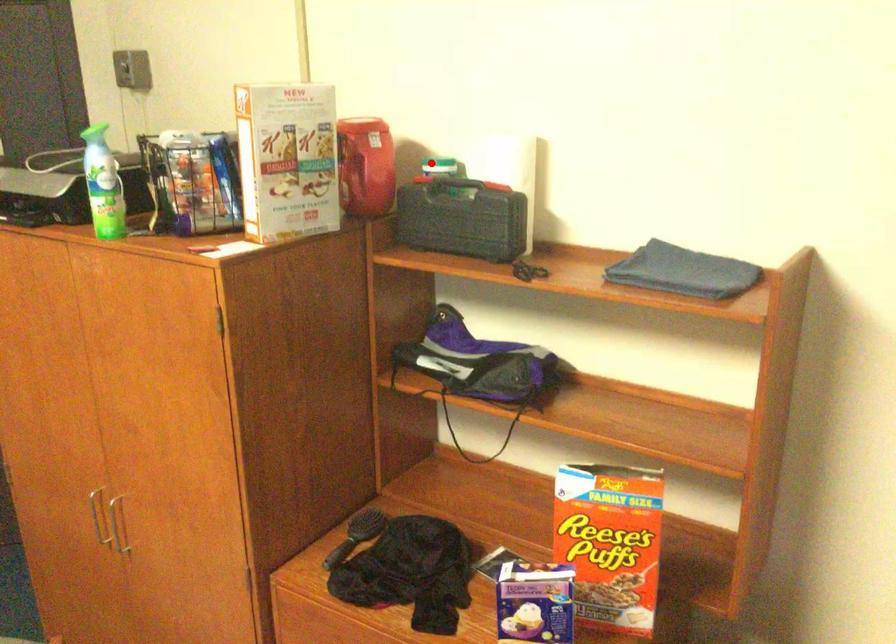
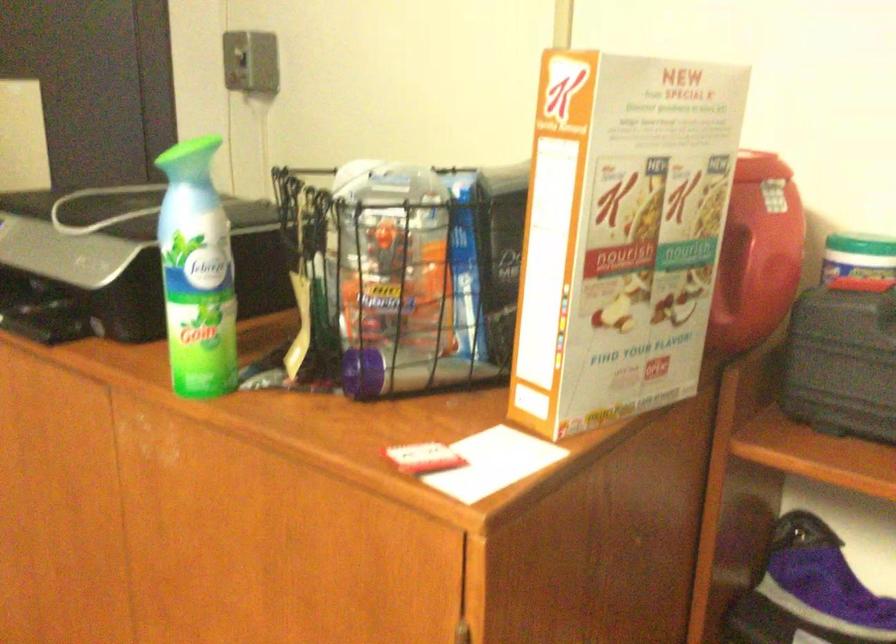
Question: A red point is marked in image1. In image2, is the corresponding 3D point closer to the camera or farther? Reply with the corresponding letter.

Choices:
 (A) The corresponding 3D point is closer.
 (B) The corresponding 3D point is farther.

Answer: (A)